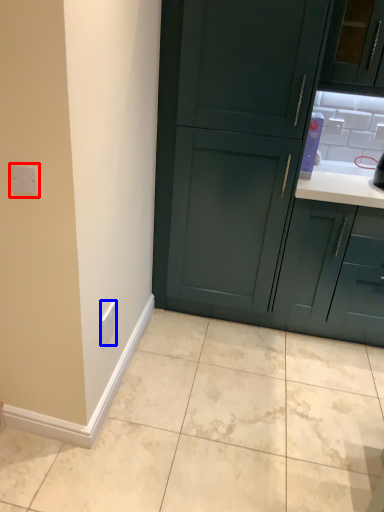
Question: Which point is closer to the camera, electric outlet (highlighted by a red box) or electric outlet (highlighted by a blue box)?

Choices:
 (A) electric outlet
 (B) electric outlet

Answer: (A)